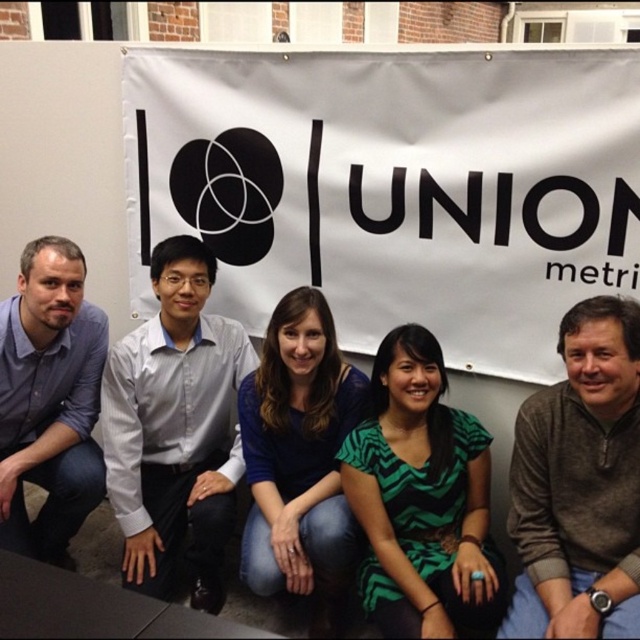
Question: Does light gray shirt at center appear over blue shirt at left?

Choices:
 (A) yes
 (B) no

Answer: (B)

Question: Does brown sweater at right appear under blue shirt at left?

Choices:
 (A) yes
 (B) no

Answer: (A)

Question: Among these points, which one is farthest from the camera?

Choices:
 (A) (168, 243)
 (B) (262, 396)

Answer: (A)

Question: Which object is farther from the camera taking this photo?

Choices:
 (A) blue shirt at left
 (B) brown sweater at right

Answer: (A)

Question: Which object is positioned closest to the blue shirt at left?

Choices:
 (A) green zigzag dress at center
 (B) blue fabric shirt at center
 (C) brown sweater at right
 (D) light gray shirt at center

Answer: (D)

Question: Is brown sweater at right to the left of blue fabric shirt at center from the viewer's perspective?

Choices:
 (A) no
 (B) yes

Answer: (A)